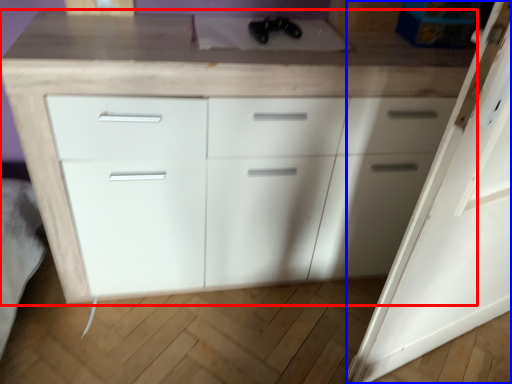
Question: Among these objects, which one is nearest to the camera, chest of drawers (highlighted by a red box) or door (highlighted by a blue box)?

Choices:
 (A) chest of drawers
 (B) door

Answer: (B)